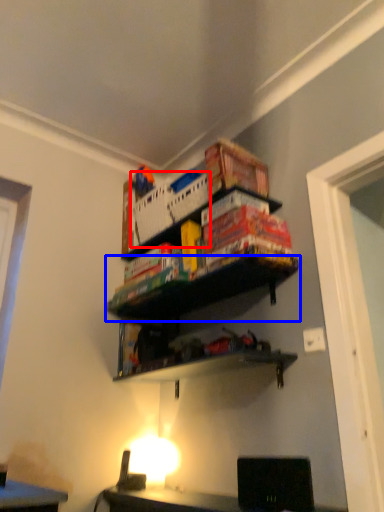
Question: Which object is further to the camera taking this photo, crate (highlighted by a red box) or shelf (highlighted by a blue box)?

Choices:
 (A) crate
 (B) shelf

Answer: (A)